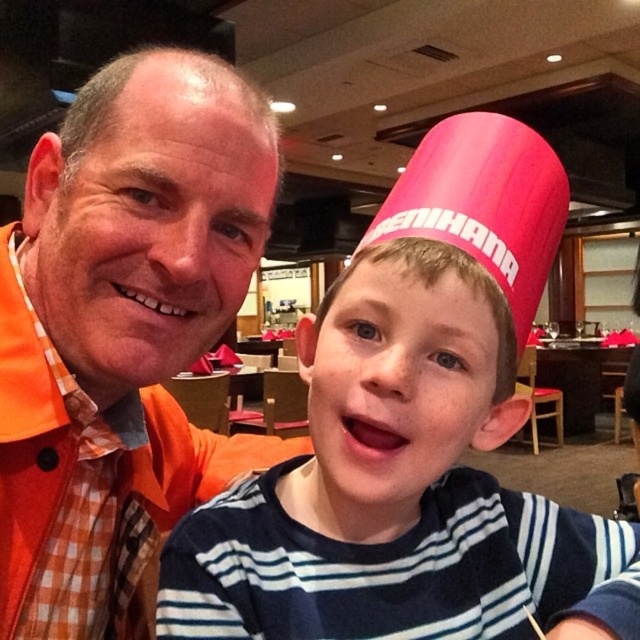
You are a photographer trying to capture a group photo of the two people in the scene. The minimum distance required between subjects for the photo to be clear is 20 centimeters. Based on the positions of the pink fabric hat at upper right and the orange checkered shirt at left, will the subjects be positioned far enough apart to ensure a clear photo?

The pink fabric hat at upper right is 19.82 centimeters from orange checkered shirt at left. Since the required minimum distance for a clear photo is 20 centimeters, the subjects are slightly too close, so the photo may not be clear.

From the picture: You are a photographer trying to capture a candid shot of the two subjects in the scene. You want to ensure that both the pink fabric hat at upper right and the orange checkered shirt at left are clearly visible in the frame. Based on their sizes, which object might require you to adjust your camera angle to avoid obstruction?

The pink fabric hat at upper right might be wider than the orange checkered shirt at left, so it could potentially block part of the frame if not positioned carefully. Adjusting the camera angle might help ensure both are visible.

Looking at this image, you are a photographer trying to capture a candid shot of the two subjects. You want to ensure that the pink fabric hat at upper right and the orange checkered shirt at left are both in frame. Based on their positions, which object should you focus on first to ensure both are captured?

The orange checkered shirt at left is to the left of the pink fabric hat at upper right, so focusing on the orange checkered shirt at left first will help ensure both objects are in frame.